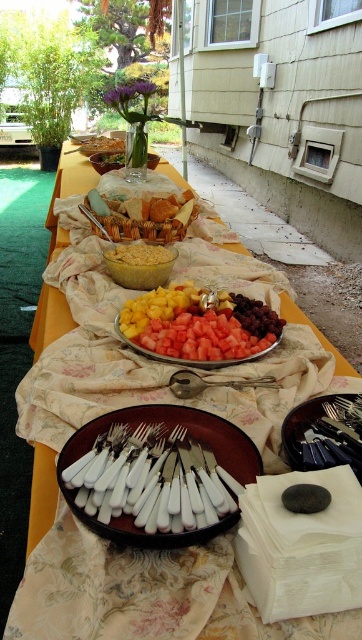
You are a guest at the buffet and want to grab a silver spoon at center to serve yourself. The shiny red plate at center has some snacks you want to try. Can you reach the spoon without moving the plate?

The shiny red plate at center is 5.84 inches away from the silver spoon at center. Since the distance is relatively small, you can likely reach the spoon without disturbing the plate.

You need to choose between the white plastic forks at center and the silver spoon at center for serving a large salad. Which one is more suitable based on their sizes?

The white plastic forks at center is larger in size than the silver spoon at center, so it would be more suitable for serving a large salad.